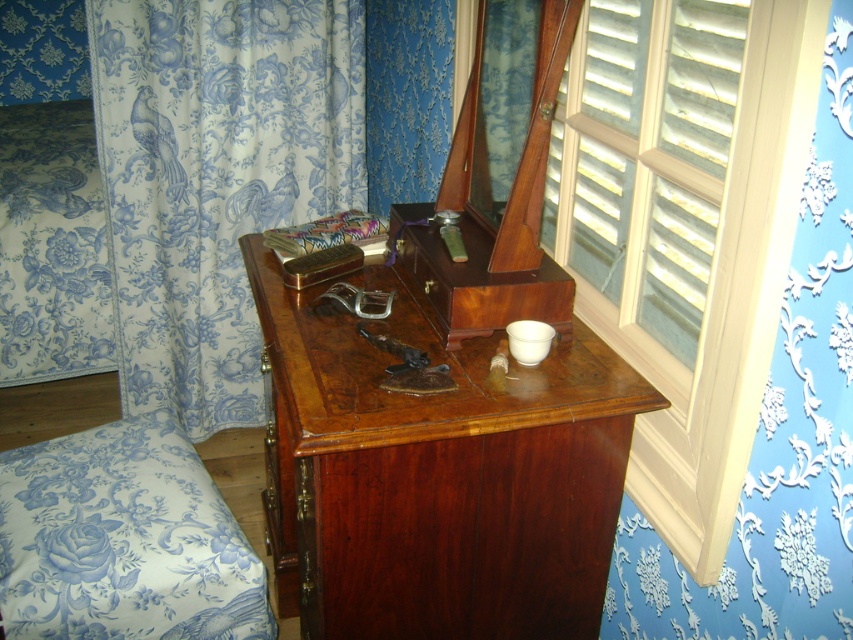
You are arranging a historical exhibit and need to place a decorative pillow on top of the mahogany wood dresser at center. However, the exhibit guidelines state that items must not be placed on top of other objects. Is the current placement of the silky multicolored pillow at center compliant with the guidelines?

The silky multicolored pillow at center is positioned above the mahogany wood dresser at center, so it is placed on top of it. This violates the exhibit guidelines which prohibit placing items on top of other objects.

You are a guest in this room and want to move from the blue floral fabric armchair at lower left to the mahogany wood dresser at center. Can you reach the dresser without moving the chair?

The mahogany wood dresser at center and blue floral fabric armchair at lower left are 14.81 inches apart. Since the distance between them is only 14.81 inches, you can easily reach the mahogany wood dresser at center without moving the blue floral fabric armchair at lower left.